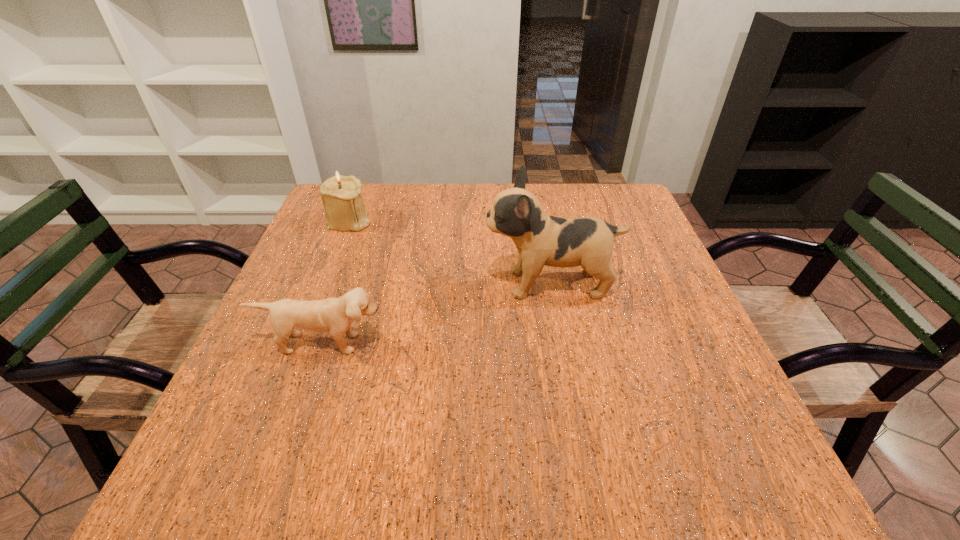
This screenshot has height=540, width=960. What are the coordinates of `free space that is in between the left puppy and the farthest object` in the screenshot? It's located at (336, 282).

Identify the location of vacant space that's between the second nearest object and the left puppy. (437, 314).

Locate which object ranks second in proximity to the tallest object. Please provide its 2D coordinates. Your answer should be formatted as a tuple, i.e. [(x, y)], where the tuple contains the x and y coordinates of a point satisfying the conditions above.

[(341, 195)]

Point out which object is positioned as the second nearest to the shortest object. Please provide its 2D coordinates. Your answer should be formatted as a tuple, i.e. [(x, y)], where the tuple contains the x and y coordinates of a point satisfying the conditions above.

[(341, 195)]

You are a GUI agent. You are given a task and a screenshot of the screen. Output one action in this format:
    pyautogui.click(x=<x>, y=<y>)
    Task: Click on the free space that satisfies the following two spatial constraints: 1. at the face of the second farthest object; 2. on the left side of the shorter puppy
    Image resolution: width=960 pixels, height=540 pixels.
    Given the screenshot: What is the action you would take?
    pyautogui.click(x=562, y=343)

This screenshot has height=540, width=960. I want to click on free region that satisfies the following two spatial constraints: 1. at the face of the farther puppy; 2. on the left side of the nearest object, so click(562, 343).

Locate an element on the screen. The image size is (960, 540). free location that satisfies the following two spatial constraints: 1. at the face of the rightmost object; 2. on the left side of the shorter puppy is located at coordinates (562, 343).

Identify the location of vacant space that satisfies the following two spatial constraints: 1. at the face of the rightmost object; 2. on the left side of the shortest object. (562, 343).